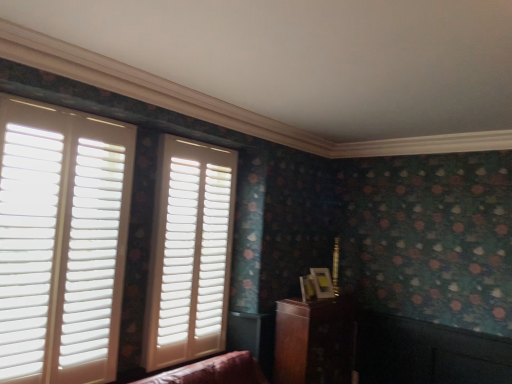
Question: From the image's perspective, is white matte shutters at center, arranged as the 2th window when viewed from the front, below wooden cabinet at lower right?

Choices:
 (A) no
 (B) yes

Answer: (A)

Question: Is white matte shutters at center, positioned as the second window in left-to-right order, shorter than wooden cabinet at lower right?

Choices:
 (A) no
 (B) yes

Answer: (A)

Question: Considering the relative positions of white matte shutters at center, arranged as the 2th window when viewed from the front, and wooden cabinet at lower right in the image provided, is white matte shutters at center, arranged as the 2th window when viewed from the front, in front of wooden cabinet at lower right?

Choices:
 (A) yes
 (B) no

Answer: (A)

Question: From the image's perspective, does white matte shutters at center, positioned as the second window in left-to-right order, appear higher than wooden cabinet at lower right?

Choices:
 (A) no
 (B) yes

Answer: (B)

Question: Can you confirm if white matte shutters at center, which appears as the 1th window when viewed from the back, is wider than wooden cabinet at lower right?

Choices:
 (A) no
 (B) yes

Answer: (A)

Question: Is point (129, 162) positioned closer to the camera than point (185, 240)?

Choices:
 (A) farther
 (B) closer

Answer: (B)

Question: Considering the positions of white matte shutters at left, placed as the 2th window when sorted from back to front, and white matte shutters at center, which appears as the 1th window when viewed from the back, in the image, is white matte shutters at left, placed as the 2th window when sorted from back to front, wider or thinner than white matte shutters at center, which appears as the 1th window when viewed from the back,?

Choices:
 (A) thin
 (B) wide

Answer: (B)

Question: In terms of size, does white matte shutters at left, placed as the 2th window when sorted from back to front, appear bigger or smaller than white matte shutters at center, positioned as the second window in left-to-right order?

Choices:
 (A) big
 (B) small

Answer: (A)

Question: From the image's perspective, is white matte shutters at left, placed as the first window when sorted from front to back, positioned above or below white matte shutters at center, which appears as the 1th window when viewed from the back?

Choices:
 (A) below
 (B) above

Answer: (B)

Question: From the image's perspective, relative to white matte shutters at left, placed as the 2th window when sorted from right to left, is white matte shutters at center, positioned as the second window in left-to-right order, above or below?

Choices:
 (A) below
 (B) above

Answer: (A)

Question: From a real-world perspective, is white matte shutters at center, positioned as the second window in left-to-right order, positioned above or below white matte shutters at left, placed as the 2th window when sorted from back to front?

Choices:
 (A) above
 (B) below

Answer: (B)

Question: Considering the positions of white matte shutters at center, which appears as the 1th window when viewed from the back, and white matte shutters at left, the 1th window in the left-to-right sequence, in the image, is white matte shutters at center, which appears as the 1th window when viewed from the back, wider or thinner than white matte shutters at left, the 1th window in the left-to-right sequence,?

Choices:
 (A) thin
 (B) wide

Answer: (A)

Question: Does point (174, 170) appear closer or farther from the camera than point (55, 122)?

Choices:
 (A) farther
 (B) closer

Answer: (A)

Question: Is wooden cabinet at lower right in front of or behind white matte shutters at center, arranged as the 2th window when viewed from the front, in the image?

Choices:
 (A) front
 (B) behind

Answer: (B)

Question: Does point (312, 319) appear closer or farther from the camera than point (210, 279)?

Choices:
 (A) closer
 (B) farther

Answer: (A)